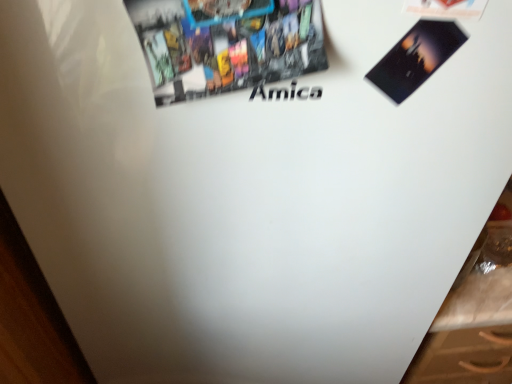
Question: Would you say matte paper flyer at upper right is outside matte paper poster at upper center?

Choices:
 (A) yes
 (B) no

Answer: (A)

Question: Considering the relative positions of matte paper flyer at upper right and matte paper poster at upper center in the image provided, is matte paper flyer at upper right to the left of matte paper poster at upper center from the viewer's perspective?

Choices:
 (A) yes
 (B) no

Answer: (B)

Question: From a real-world perspective, does matte paper flyer at upper right stand above matte paper poster at upper center?

Choices:
 (A) no
 (B) yes

Answer: (A)

Question: Could you tell me if matte paper flyer at upper right is turned towards matte paper poster at upper center?

Choices:
 (A) no
 (B) yes

Answer: (A)

Question: Is matte paper flyer at upper right beside matte paper poster at upper center?

Choices:
 (A) no
 (B) yes

Answer: (A)

Question: From the image's perspective, is matte paper flyer at upper right below matte paper poster at upper center?

Choices:
 (A) no
 (B) yes

Answer: (A)

Question: Is matte paper poster at upper center far away from matte paper flyer at upper right?

Choices:
 (A) yes
 (B) no

Answer: (B)

Question: Would you say matte paper flyer at upper right is part of matte paper poster at upper center's contents?

Choices:
 (A) no
 (B) yes

Answer: (A)

Question: Is matte paper poster at upper center positioned with its back to matte paper flyer at upper right?

Choices:
 (A) no
 (B) yes

Answer: (A)

Question: From a real-world perspective, is matte paper poster at upper center positioned under matte paper flyer at upper right based on gravity?

Choices:
 (A) yes
 (B) no

Answer: (B)

Question: Could you tell me if matte paper poster at upper center is turned towards matte paper flyer at upper right?

Choices:
 (A) yes
 (B) no

Answer: (B)

Question: Can you confirm if matte paper poster at upper center is positioned to the right of matte paper flyer at upper right?

Choices:
 (A) yes
 (B) no

Answer: (B)

Question: In the image, is matte paper poster at upper center positioned in front of or behind matte paper flyer at upper right?

Choices:
 (A) front
 (B) behind

Answer: (A)